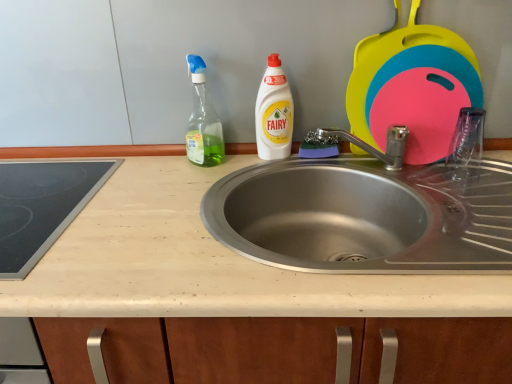
Question: Is beige laminate countertop at center looking in the opposite direction of black glass cooktop at left?

Choices:
 (A) no
 (B) yes

Answer: (A)

Question: From a real-world perspective, is beige laminate countertop at center physically below black glass cooktop at left?

Choices:
 (A) yes
 (B) no

Answer: (A)

Question: Can you confirm if beige laminate countertop at center is positioned to the left of black glass cooktop at left?

Choices:
 (A) no
 (B) yes

Answer: (A)

Question: Does beige laminate countertop at center have a larger size compared to black glass cooktop at left?

Choices:
 (A) no
 (B) yes

Answer: (B)

Question: Would you say beige laminate countertop at center is outside black glass cooktop at left?

Choices:
 (A) yes
 (B) no

Answer: (A)

Question: Is green glass spray bottle at upper left, placed as the 1th cleaning product when sorted from left to right, taller or shorter than white plastic bottle at center, placed as the second cleaning product when sorted from left to right?

Choices:
 (A) tall
 (B) short

Answer: (A)

Question: In terms of width, does green glass spray bottle at upper left, which is the 2th cleaning product in right-to-left order, look wider or thinner when compared to white plastic bottle at center, acting as the 1th cleaning product starting from the right?

Choices:
 (A) thin
 (B) wide

Answer: (B)

Question: Considering their positions, is green glass spray bottle at upper left, which is the 2th cleaning product in right-to-left order, located in front of or behind white plastic bottle at center, placed as the second cleaning product when sorted from left to right?

Choices:
 (A) front
 (B) behind

Answer: (A)

Question: From the image's perspective, is green glass spray bottle at upper left, which is the 2th cleaning product in right-to-left order, located above or below white plastic bottle at center, placed as the second cleaning product when sorted from left to right?

Choices:
 (A) above
 (B) below

Answer: (A)

Question: Relative to black glass cooktop at left, is green glass spray bottle at upper left, placed as the 1th cleaning product when sorted from left to right, in front or behind?

Choices:
 (A) front
 (B) behind

Answer: (B)

Question: Is green glass spray bottle at upper left, placed as the 1th cleaning product when sorted from left to right, taller or shorter than black glass cooktop at left?

Choices:
 (A) tall
 (B) short

Answer: (A)

Question: Is green glass spray bottle at upper left, which is the 2th cleaning product in right-to-left order, wider or thinner than black glass cooktop at left?

Choices:
 (A) wide
 (B) thin

Answer: (B)

Question: Considering the positions of point (202, 99) and point (11, 218), is point (202, 99) closer or farther from the camera than point (11, 218)?

Choices:
 (A) farther
 (B) closer

Answer: (A)

Question: Considering the positions of beige laminate countertop at center and white plastic bottle at center, acting as the 1th cleaning product starting from the right, in the image, is beige laminate countertop at center taller or shorter than white plastic bottle at center, acting as the 1th cleaning product starting from the right,?

Choices:
 (A) short
 (B) tall

Answer: (B)

Question: Is point (142, 284) positioned closer to the camera than point (287, 145)?

Choices:
 (A) farther
 (B) closer

Answer: (B)